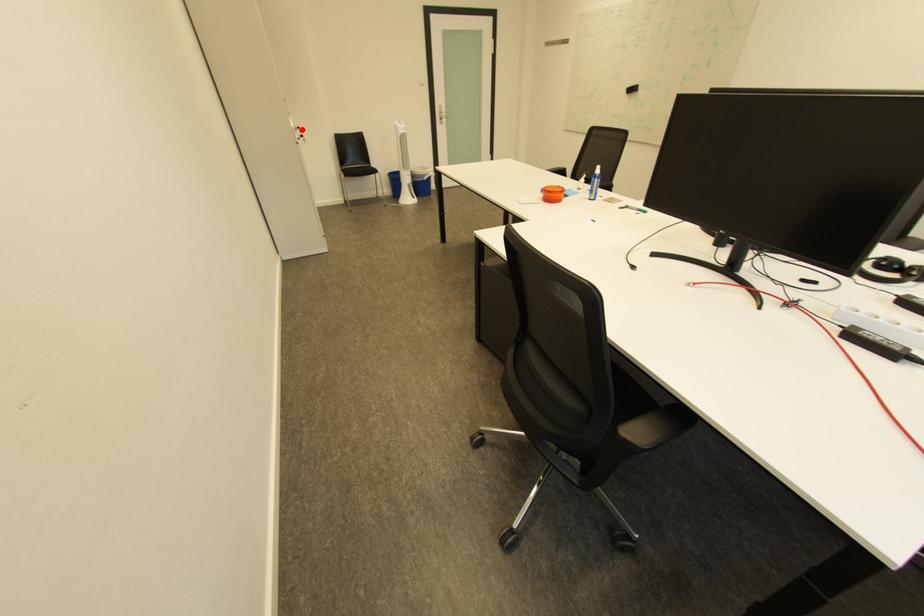
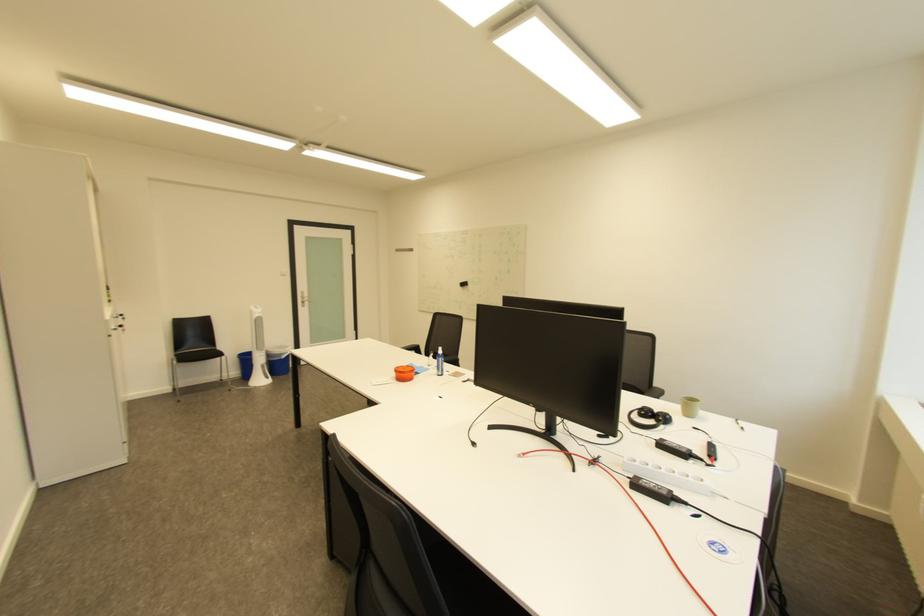
Find the pixel in the second image that matches the highlighted location in the first image.

(116, 322)